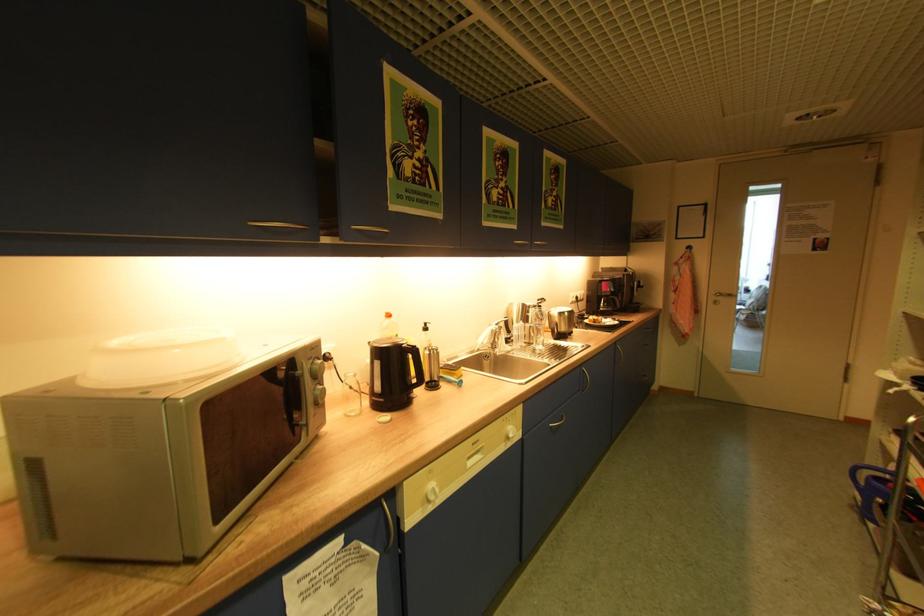
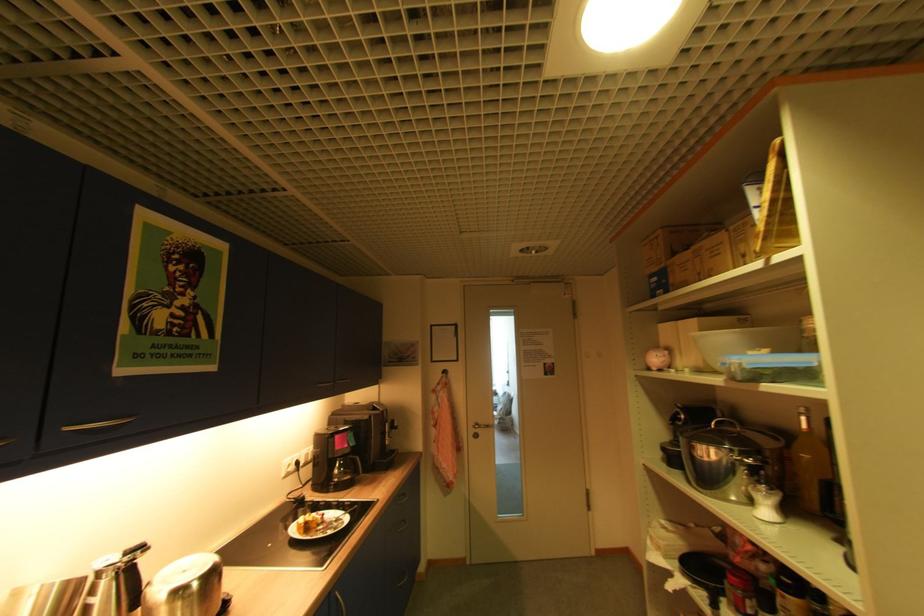
In the second image, find the point that corresponds to (725,300) in the first image.

(484, 431)